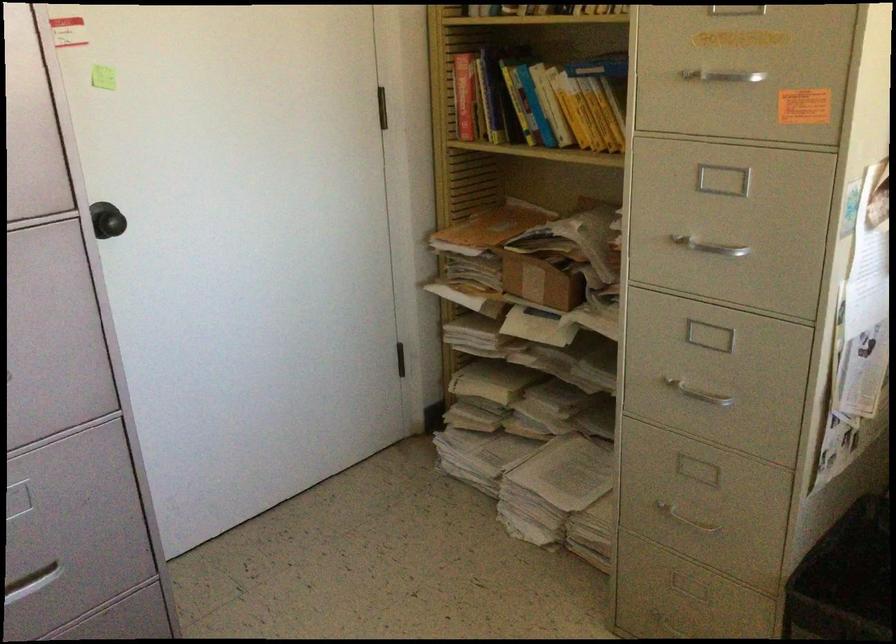
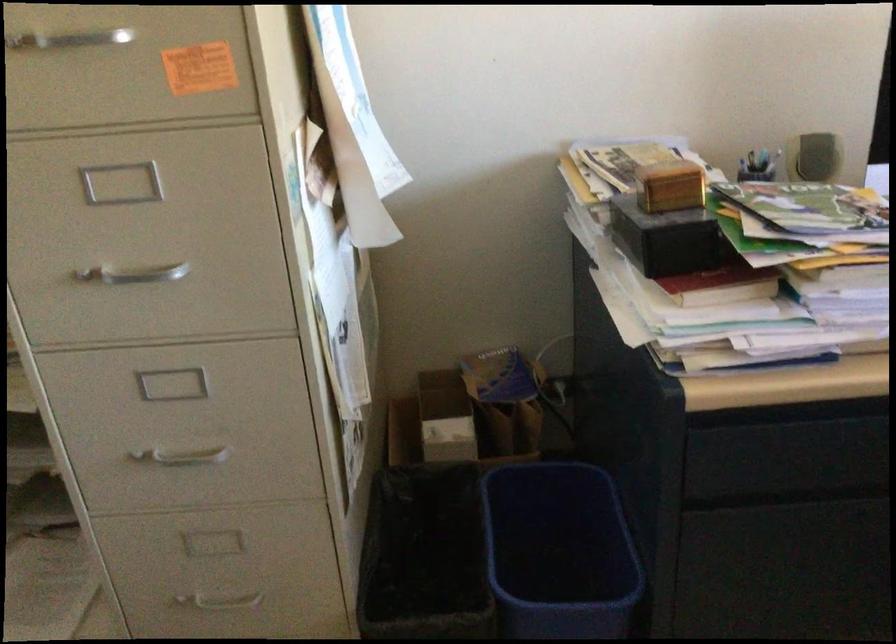
The point at (690, 392) is marked in the first image. Where is the corresponding point in the second image?

(181, 456)